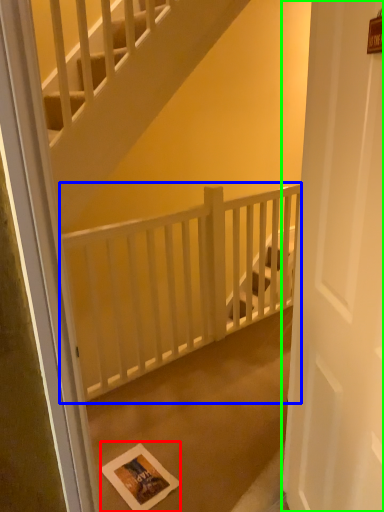
Question: Which object is positioned farthest from postcard (highlighted by a red box)? Select from balustrade (highlighted by a blue box) and door (highlighted by a green box).

Choices:
 (A) balustrade
 (B) door

Answer: (B)